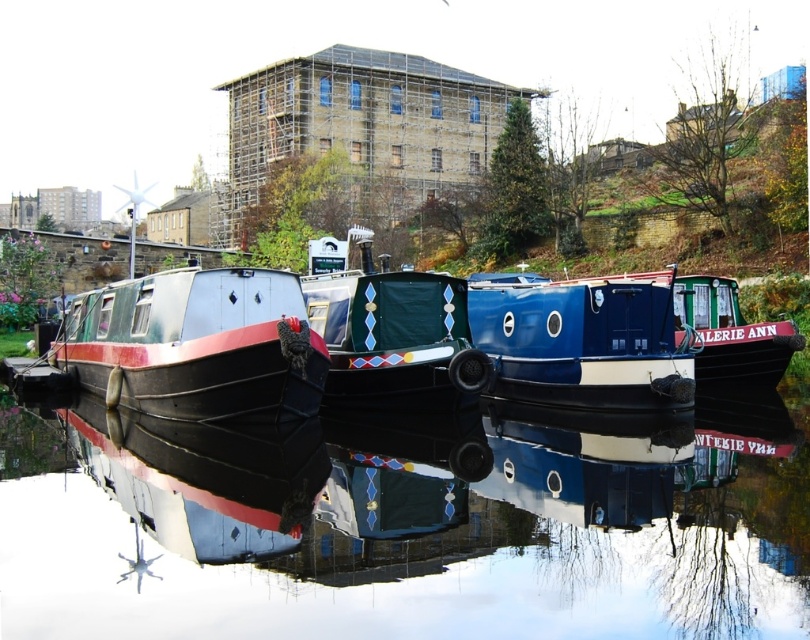
You are a photographer planning to capture the reflection of the boats in the water. You want to ensure that the matte black boat at left and the matte blue and white boat at center are both fully visible in the reflection. Based on their positions, which boat should you position yourself closer to in order to frame both boats within the reflection?

You should position yourself closer to the matte black boat at left because it is to the left of the matte blue and white boat at center, allowing you to frame both boats within the reflection by centering your view between them.

You are standing at the edge of the waterway and want to place a small floating marker exactly at the center of the glossy black water at center. According to the coordinates provided, where should you place the marker?

The glossy black water at center should have the marker placed at the coordinates point (x=403, y=529) as specified in the description.